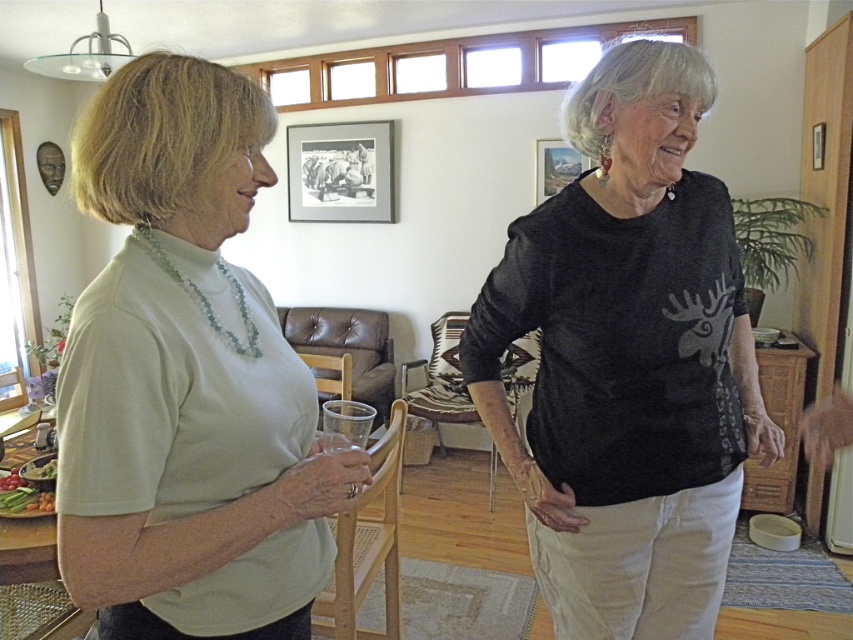
Does light beige t-shirt at left appear on the left side of metallic silver picture frame at upper center?

In fact, light beige t-shirt at left is to the right of metallic silver picture frame at upper center.

The image size is (853, 640). I want to click on light beige t-shirt at left, so coord(186,380).

Where is `light beige t-shirt at left`? Image resolution: width=853 pixels, height=640 pixels. light beige t-shirt at left is located at coordinates (186, 380).

Does charcoal heathered shirt at center appear under metallic silver picture frame at upper center?

Yes.

Is point (605, 452) closer to camera compared to point (325, 150)?

Yes, it is.

The width and height of the screenshot is (853, 640). In order to click on charcoal heathered shirt at center in this screenshot , I will do `click(627, 360)`.

Does light beige t-shirt at left lie in front of charcoal heathered shirt at center?

That is True.

Between point (334, 499) and point (722, 449), which one is positioned in front?

Point (334, 499) is in front.

Image resolution: width=853 pixels, height=640 pixels. What are the coordinates of `light beige t-shirt at left` in the screenshot? It's located at (186, 380).